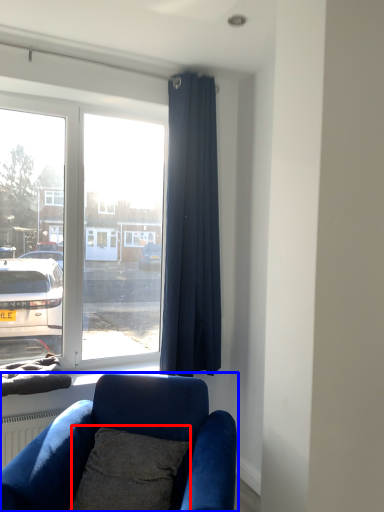
Question: Which object appears farthest to the camera in this image, pillow (highlighted by a red box) or studio couch (highlighted by a blue box)?

Choices:
 (A) pillow
 (B) studio couch

Answer: (A)